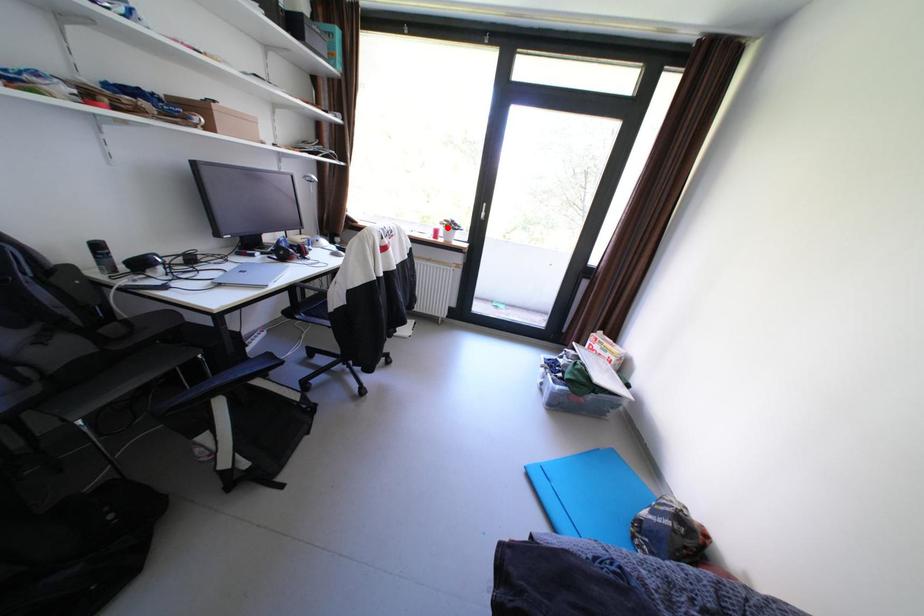
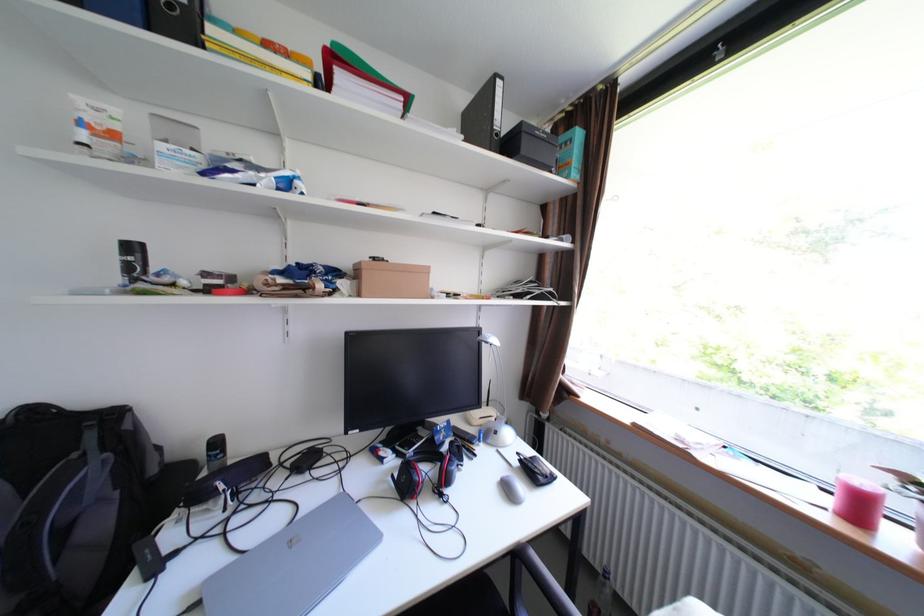
In the second image, find the point that corresponds to the highlighted location in the first image.

(874, 484)